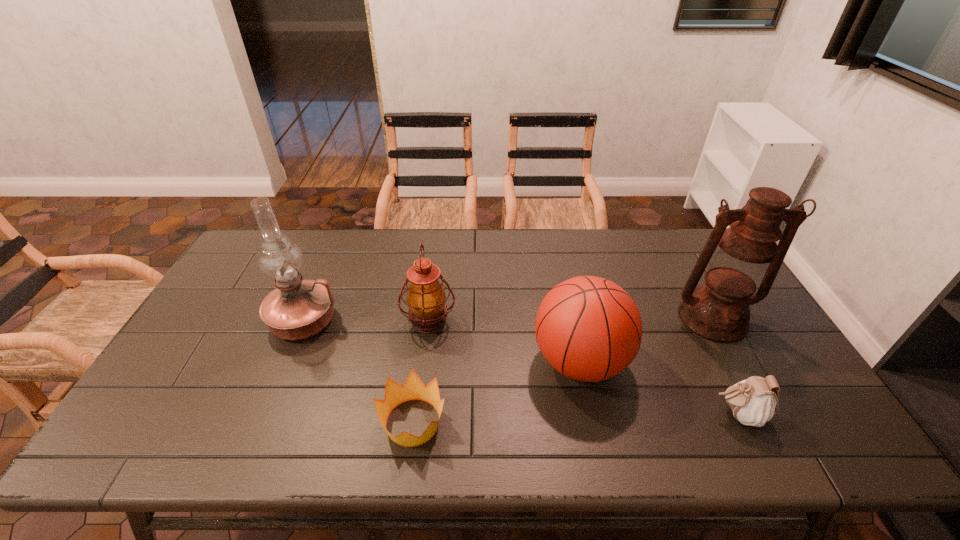
The width and height of the screenshot is (960, 540). In the image, there is a desktop. What are the coordinates of `vacant region at the near edge` in the screenshot? It's located at (671, 436).

Where is `vacant space at the left edge of the desktop`? The image size is (960, 540). vacant space at the left edge of the desktop is located at coordinates pyautogui.click(x=214, y=347).

Locate an element on the screen. vacant area at the right edge is located at coordinates (756, 360).

In the image, there is a desktop. Identify the location of vacant area at the near right corner. The height and width of the screenshot is (540, 960). (780, 430).

Where is `free point between the shortest object and the leftmost oil lamp`? The height and width of the screenshot is (540, 960). free point between the shortest object and the leftmost oil lamp is located at coordinates (358, 372).

I want to click on free spot between the third object from right to left and the rightmost oil lamp, so click(x=646, y=340).

Where is `free spot between the pouch and the leftmost object`? free spot between the pouch and the leftmost object is located at coordinates (520, 368).

Locate an element on the screen. free spot between the basketball and the rightmost oil lamp is located at coordinates (646, 340).

This screenshot has height=540, width=960. I want to click on free space between the basketball and the rightmost oil lamp, so click(x=646, y=340).

The height and width of the screenshot is (540, 960). Identify the location of vacant point located between the fifth tallest object and the crown. (575, 418).